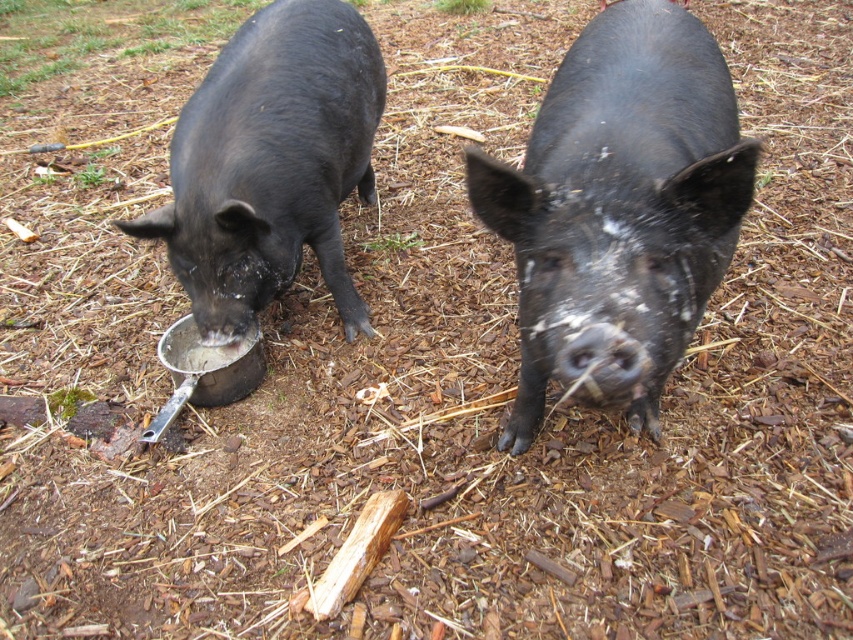
Question: Which object appears farthest from the camera in this image?

Choices:
 (A) shiny black pig at center
 (B) black matte pig at center

Answer: (A)

Question: Is black matte pig at center above shiny black pig at center?

Choices:
 (A) no
 (B) yes

Answer: (A)

Question: Which point appears closest to the camera in this image?

Choices:
 (A) 207,218
 (B) 695,161

Answer: (B)

Question: From the image, what is the correct spatial relationship of black matte pig at center in relation to shiny black pig at center?

Choices:
 (A) above
 (B) below

Answer: (B)

Question: Can you confirm if black matte pig at center is bigger than shiny black pig at center?

Choices:
 (A) yes
 (B) no

Answer: (A)